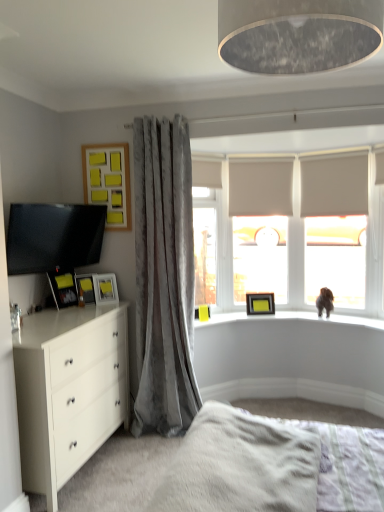
Identify the location of free spot in front of yellow matte picture frame at left, which is counted as the third picture frame, starting from the left. (97, 307).